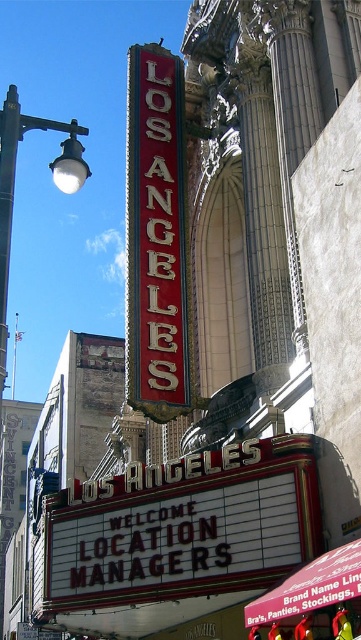
You are standing in front of the Los Angeles Theatre marquee. There is a point at coordinates (155, 236). What object is located at this point?

The point at coordinates (155, 236) indicates the red enamel sign at upper center.

Consider the image. You are standing in front of the Los Angeles Theatre marquee. You see a red enamel sign at upper center and a white metal streetlight at upper left. Which object is closer to your right side?

The red enamel sign at upper center is to the right of the white metal streetlight at upper left, so it is closer to your right side.